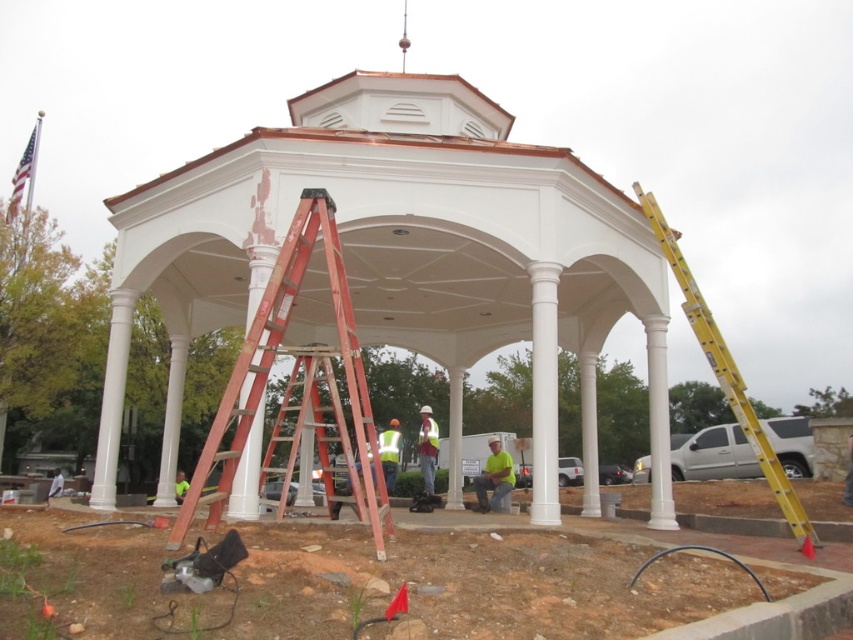
You are a painter standing at the base of the gazebo and need to reach the roof vents to apply a fresh coat of paint. You have access to the red painted wood ladder at center and the green fabric shirt at center. Which object should you use to safely reach the vents?

The red painted wood ladder at center has a greater height compared to the green fabric shirt at center, so you should use the red painted wood ladder at center to safely reach the vents.

You are standing in front of the gazebo and notice two points marked on the ground. The first point is at coordinate point(422, 616) and the second is at point(379, 442). Which point is closer to you?

Point(422, 616) is closer to the camera than point(379, 442).